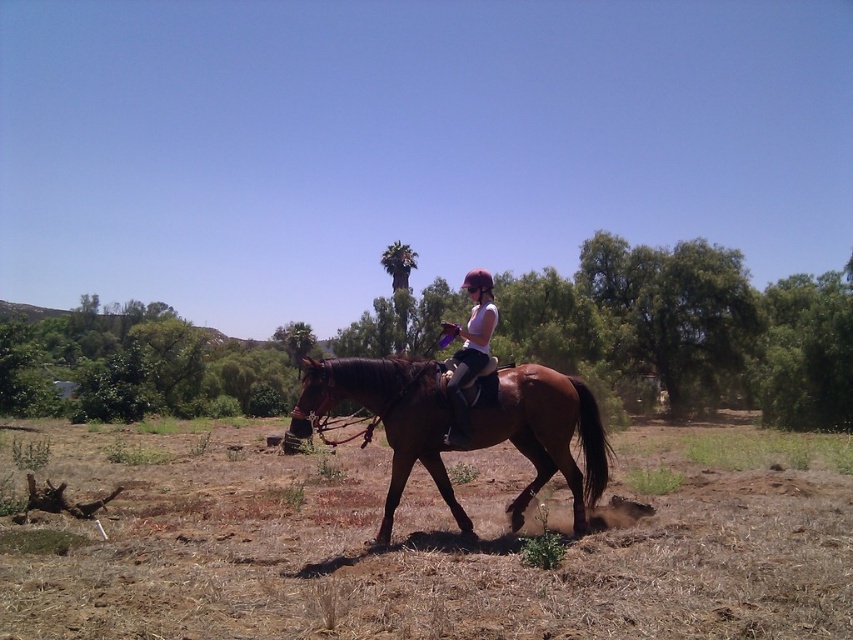
Question: Considering the relative positions of brown soil at lower center and shiny brown horse at center in the image provided, where is brown soil at lower center located with respect to shiny brown horse at center?

Choices:
 (A) above
 (B) below

Answer: (B)

Question: Does shiny brown horse at center have a lesser width compared to white matte shirt at center?

Choices:
 (A) no
 (B) yes

Answer: (A)

Question: Which of these objects is positioned closest to the white matte shirt at center?

Choices:
 (A) brown soil at lower center
 (B) shiny brown horse at center

Answer: (B)

Question: Does brown soil at lower center appear on the right side of shiny brown horse at center?

Choices:
 (A) yes
 (B) no

Answer: (B)

Question: Which point appears closest to the camera in this image?

Choices:
 (A) (577, 522)
 (B) (445, 324)
 (C) (756, 576)

Answer: (C)

Question: Which object is the closest to the white matte shirt at center?

Choices:
 (A) brown soil at lower center
 (B) shiny brown horse at center

Answer: (B)